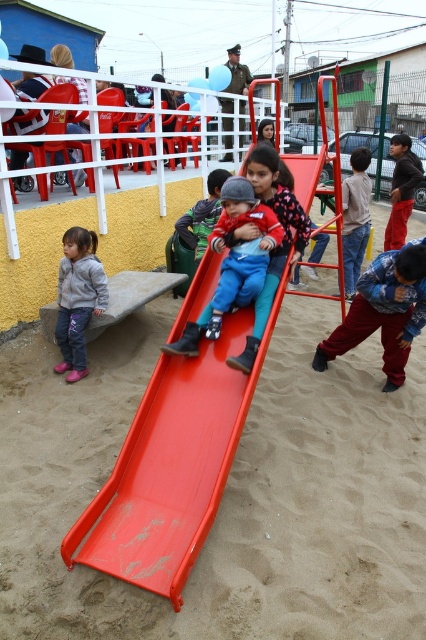
Who is taller, smooth sand at center or gray fleece jacket at lower left?

smooth sand at center

Is point (100, 611) farther from camera compared to point (68, 285)?

No, (100, 611) is in front of (68, 285).

Does point (57, 394) come behind point (72, 305)?

No, it is in front of (72, 305).

The width and height of the screenshot is (426, 640). I want to click on smooth sand at center, so click(x=224, y=493).

Where is `smooth plastic slide at center`? This screenshot has height=640, width=426. smooth plastic slide at center is located at coordinates (172, 465).

Where is `smooth plastic slide at center`? Image resolution: width=426 pixels, height=640 pixels. smooth plastic slide at center is located at coordinates (172, 465).

Does smooth plastic slide at center have a lesser width compared to blue fleece jacket at lower right?

In fact, smooth plastic slide at center might be wider than blue fleece jacket at lower right.

The width and height of the screenshot is (426, 640). Describe the element at coordinates (172, 465) in the screenshot. I see `smooth plastic slide at center` at that location.

I want to click on smooth plastic slide at center, so click(x=172, y=465).